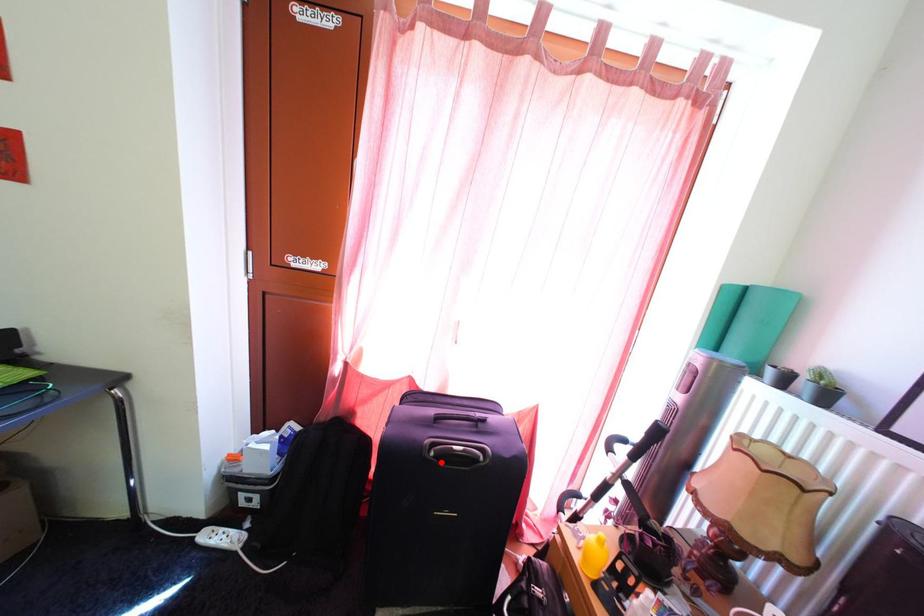
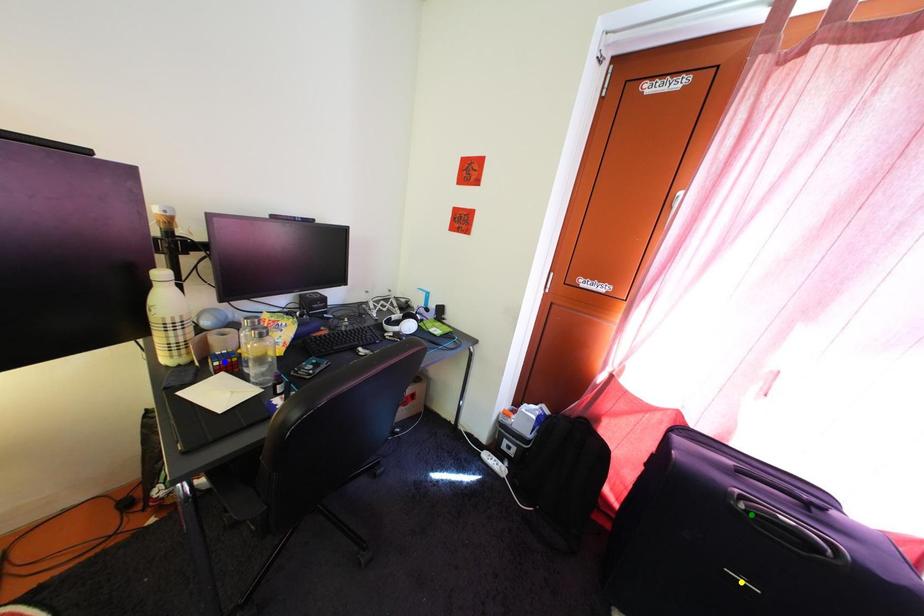
Question: I am providing you with two images of the same scene from different viewpoints. A red point is marked on the first image. You are given multiple points on the second image. In image 2, which mark is for the same physical point as the one in image 1?

Choices:
 (A) green point
 (B) yellow point
 (C) blue point

Answer: (A)